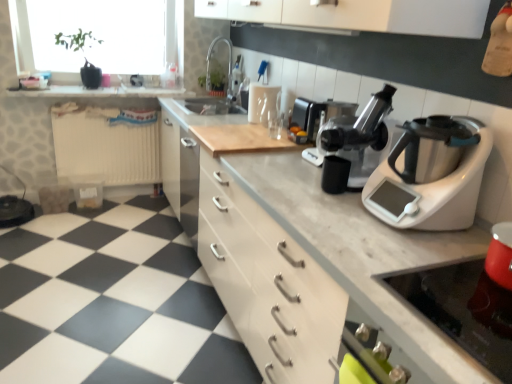
Where is `free space to the left of black plastic juicer at center`? The image size is (512, 384). free space to the left of black plastic juicer at center is located at coordinates (292, 181).